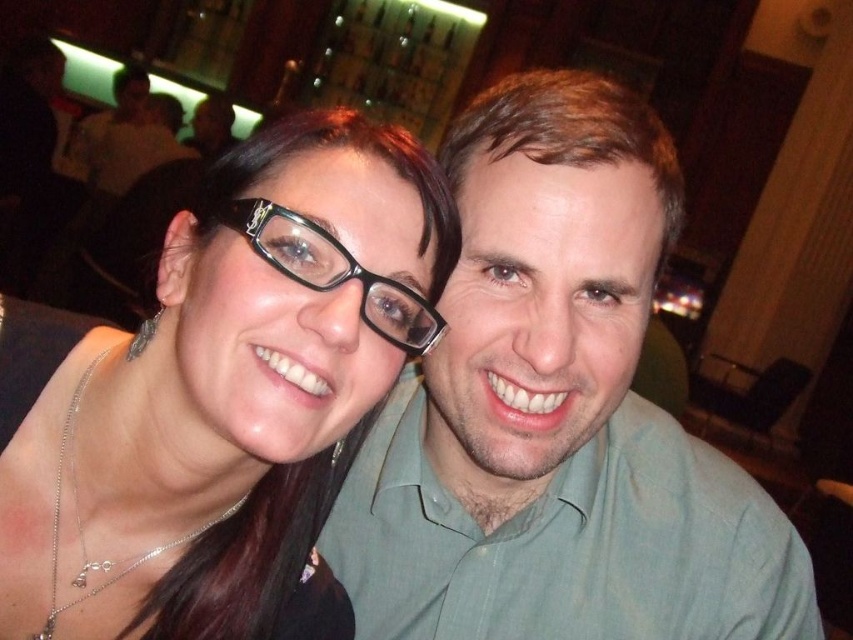
Question: Is matte black glasses at upper left behind black plastic glasses at center?

Choices:
 (A) yes
 (B) no

Answer: (B)

Question: Is matte black glasses at upper left further to the viewer compared to black plastic glasses at center?

Choices:
 (A) no
 (B) yes

Answer: (A)

Question: Which point appears closest to the camera in this image?

Choices:
 (A) (540, 204)
 (B) (422, 330)

Answer: (B)

Question: Which of the following is the farthest from the observer?

Choices:
 (A) (706, 522)
 (B) (366, 394)

Answer: (A)

Question: Is green textured shirt at center further to the viewer compared to black plastic glasses at center?

Choices:
 (A) no
 (B) yes

Answer: (B)

Question: Which of the following is the farthest from the observer?

Choices:
 (A) green textured shirt at center
 (B) matte black glasses at upper left
 (C) black plastic glasses at center

Answer: (A)